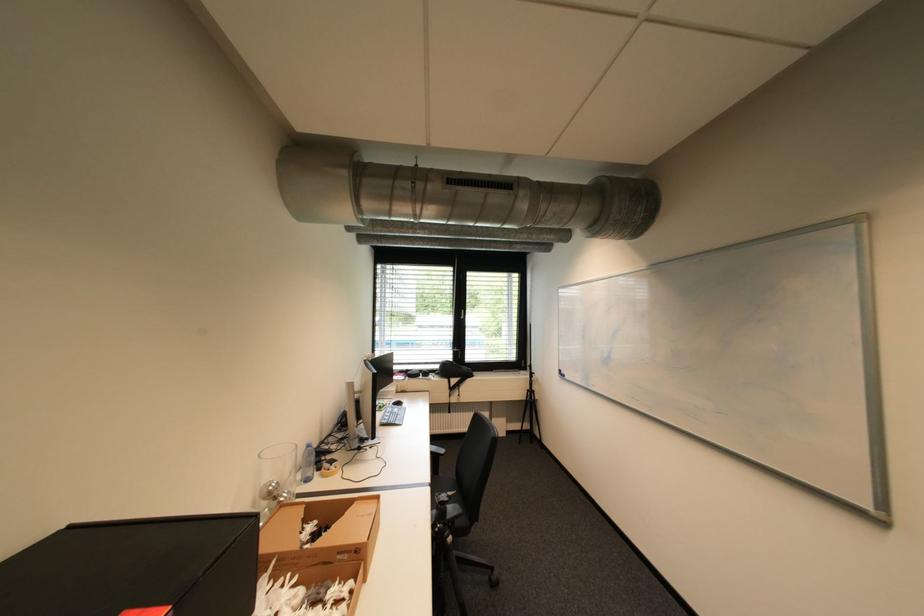
This screenshot has height=616, width=924. I want to click on black window handle, so click(472, 314).